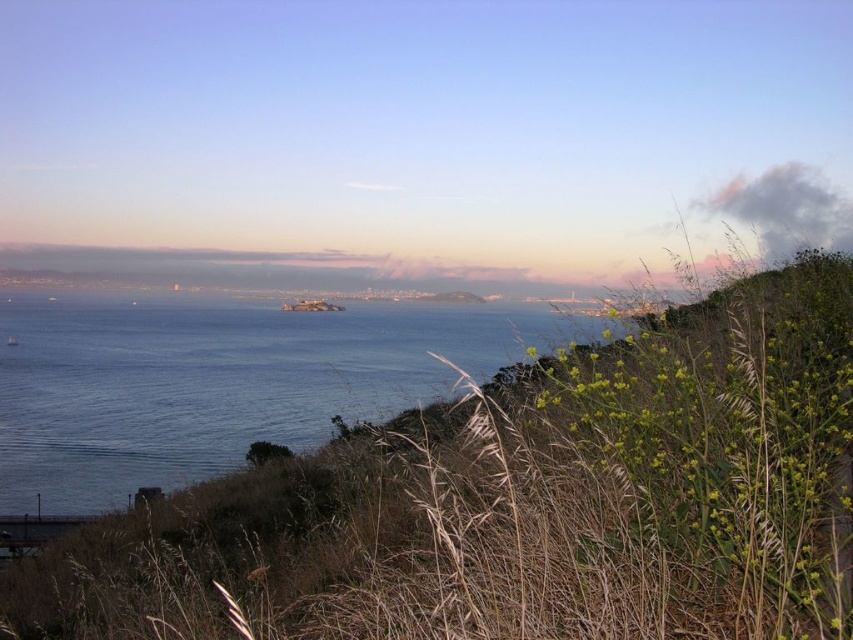
You are standing on the grassy hillside in the foreground of the coastal landscape. You see two points marked on the image. One is at point (572, 440) and the other is at point (317, 387). Which point is closer to you?

Point (572, 440) is in front of point (317, 387), so it is closer to you.

You are a photographer planning to capture the entire scene in one shot. Given that the green dry grass at lower right and blue water at center are both in view, which area takes up more space in the image?

The blue water at center occupies more space than the green dry grass at lower right in the image.

You are standing on the grassy hillside in the foreground of the coastal landscape. You notice a point marked at coordinates (521,500). What is located at that point?

The point at coordinates (521,500) is where the green dry grass at lower right is located.